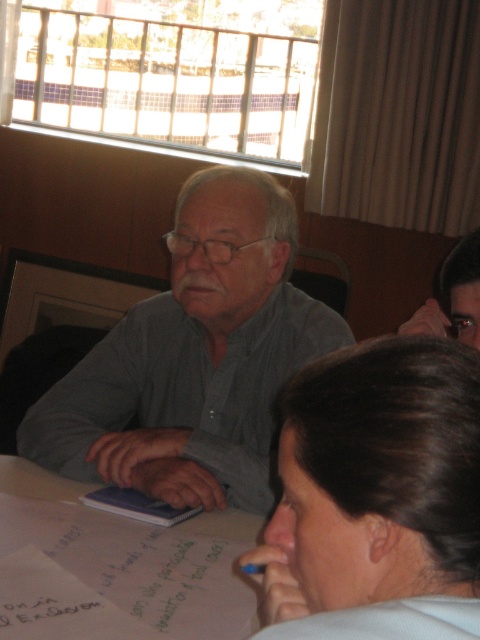
Does gray shirt at center have a lesser width compared to white paper at center?

In fact, gray shirt at center might be wider than white paper at center.

Which is below, gray shirt at center or white paper at center?

white paper at center

Where is `gray shirt at center`? This screenshot has width=480, height=640. gray shirt at center is located at coordinates (194, 358).

Identify the location of gray shirt at center. This screenshot has height=640, width=480. (194, 358).

Based on the photo, is dark brown hair at center taller than white paper at center?

Yes.

From the picture: Can you confirm if dark brown hair at center is bigger than white paper at center?

No, dark brown hair at center is not bigger than white paper at center.

Is point (460, 490) positioned after point (241, 522)?

No, (460, 490) is closer to viewer.

Locate an element on the screen. This screenshot has width=480, height=640. dark brown hair at center is located at coordinates (379, 476).

Can you confirm if gray shirt at center is smaller than dark brown hair at center?

Actually, gray shirt at center might be larger than dark brown hair at center.

Is gray shirt at center to the left of dark brown hair at center from the viewer's perspective?

Indeed, gray shirt at center is positioned on the left side of dark brown hair at center.

Where is `gray shirt at center`? This screenshot has width=480, height=640. gray shirt at center is located at coordinates (194, 358).